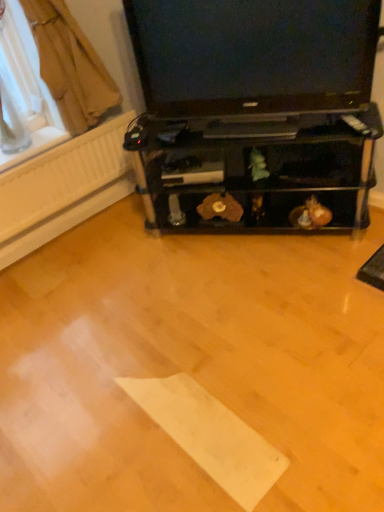
Question: In terms of size, does black glossy television at upper center appear bigger or smaller than transparent plastic window screen at upper left?

Choices:
 (A) big
 (B) small

Answer: (A)

Question: From their relative heights in the image, would you say black glossy television at upper center is taller or shorter than transparent plastic window screen at upper left?

Choices:
 (A) short
 (B) tall

Answer: (A)

Question: Which of these objects is positioned closest to the black glossy television at upper center?

Choices:
 (A) transparent plastic window screen at upper left
 (B) brown fabric curtain at upper left

Answer: (B)

Question: Which of these objects is positioned closest to the black glossy television at upper center?

Choices:
 (A) brown fabric curtain at upper left
 (B) transparent plastic window screen at upper left

Answer: (A)